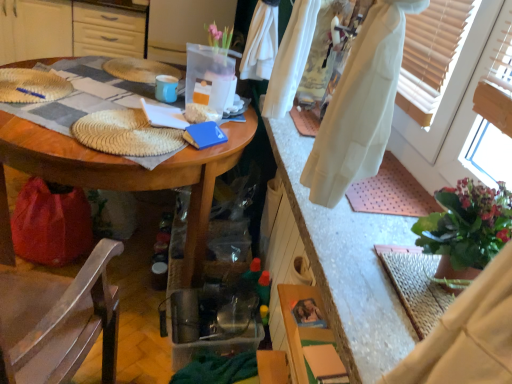
The width and height of the screenshot is (512, 384). What are the coordinates of `vacant space underneath green leafy plant at right (from a real-world perspective)` in the screenshot? It's located at (424, 275).